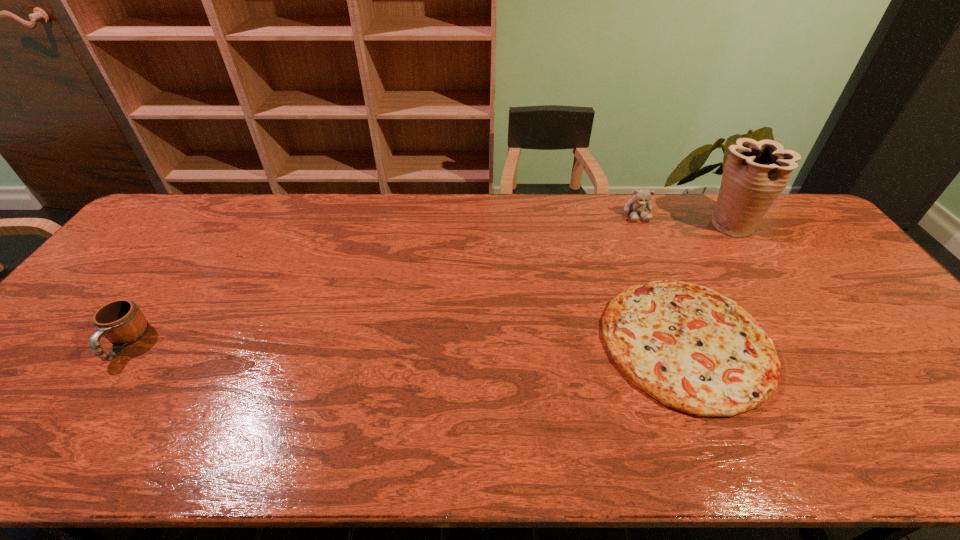
I want to click on urn at the far edge, so click(755, 174).

Locate an element on the screen. The image size is (960, 540). teddy bear at the far edge is located at coordinates click(641, 198).

Find the location of a particular element. The width and height of the screenshot is (960, 540). object that is at the left edge is located at coordinates (122, 322).

Identify the location of vacant space at the far edge of the desktop. The image size is (960, 540). (286, 217).

This screenshot has width=960, height=540. I want to click on free space at the near edge of the desktop, so click(336, 438).

At what (x,y) coordinates should I click in order to perform the action: click on free space at the right edge of the desktop. Please return your answer as a coordinate pair (x, y). The height and width of the screenshot is (540, 960). Looking at the image, I should click on (860, 291).

This screenshot has height=540, width=960. Identify the location of free space that is in between the second tallest object and the rightmost object. (684, 219).

Locate an element on the screen. free point between the shortest object and the urn is located at coordinates (708, 283).

Image resolution: width=960 pixels, height=540 pixels. Identify the location of vacant space that is in between the shortest object and the mug. (406, 342).

Locate an element on the screen. The image size is (960, 540). free spot between the urn and the mug is located at coordinates (428, 284).